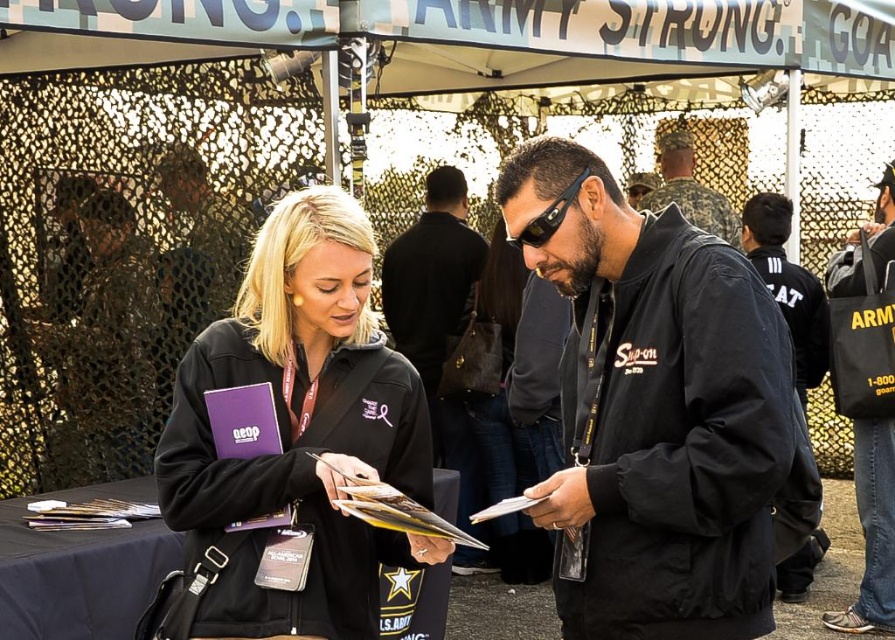
You are a photographer standing at the back of the scene. You want to take a photo of both the black fabric jacket at right and the camouflage uniform at center. Which one will appear larger in your photo?

The black fabric jacket at right will appear larger in the photo because it is closer to the viewer than the camouflage uniform at center.

In the scene shown: You are a photographer at this event and need to ensure both the black softshell jacket at center and the camouflage uniform at center are clearly visible in your photo. Based on their positions, which one might you need to adjust your camera angle to focus on more carefully?

The camouflage uniform at center is shorter than the black softshell jacket at center, so you might need to adjust your camera angle to focus on the camouflage uniform at center more carefully to ensure it is clearly visible.